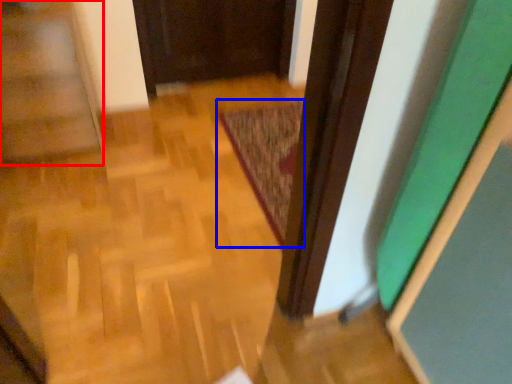
Question: Which object is closer to the camera taking this photo, stairwell (highlighted by a red box) or mat (highlighted by a blue box)?

Choices:
 (A) stairwell
 (B) mat

Answer: (A)